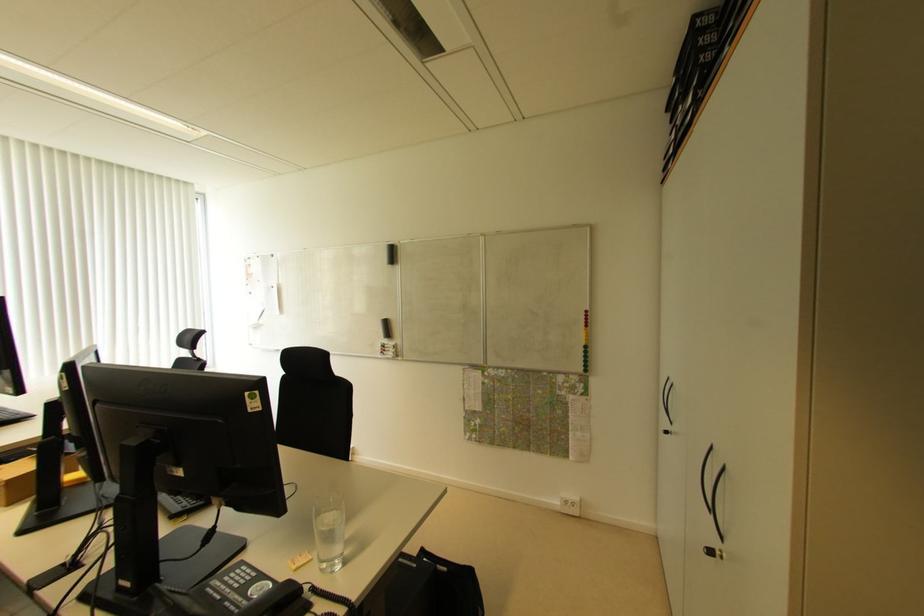
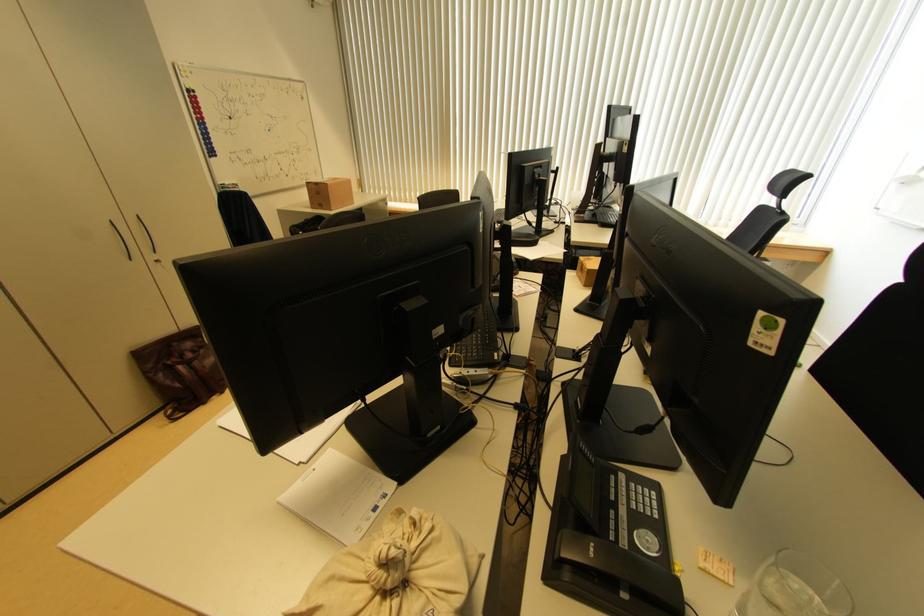
The first image is from the beginning of the video and the second image is from the end. How did the camera likely rotate when shooting the video?

The rotation direction of the camera is left-down.